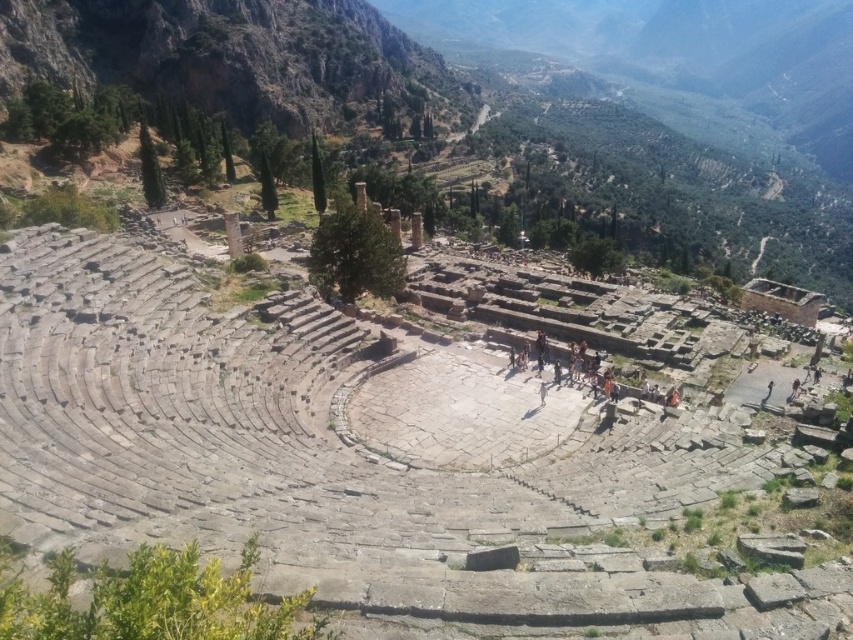
Question: Does rugged stone mountain at upper left come behind orange fabric people at center?

Choices:
 (A) yes
 (B) no

Answer: (A)

Question: Is rugged stone mountain at upper left to the left of orange fabric people at center from the viewer's perspective?

Choices:
 (A) no
 (B) yes

Answer: (B)

Question: Is rugged stone mountain at upper left above orange fabric people at center?

Choices:
 (A) yes
 (B) no

Answer: (A)

Question: Which point appears farthest from the camera in this image?

Choices:
 (A) (669, 384)
 (B) (312, 52)

Answer: (B)